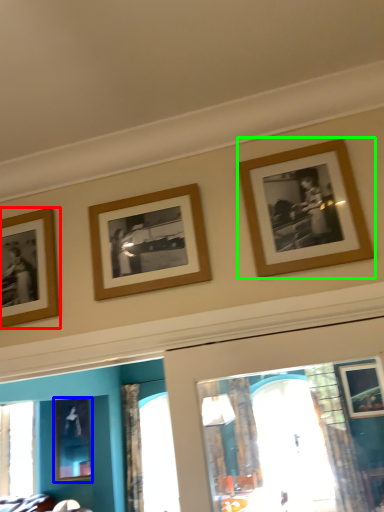
Question: Estimate the real-world distances between objects in this image. Which object is closer to picture frame (highlighted by a red box), picture frame (highlighted by a blue box) or picture frame (highlighted by a green box)?

Choices:
 (A) picture frame
 (B) picture frame

Answer: (B)